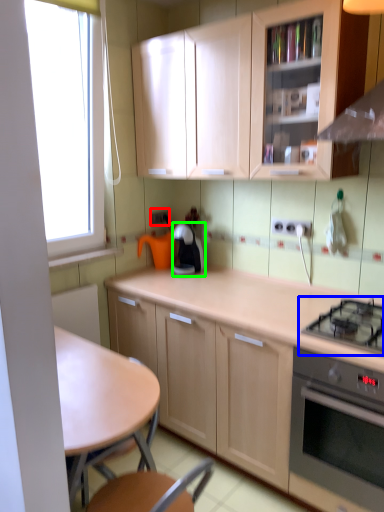
Question: Which is farther away from electric outlet (highlighted by a red box)? gas stove (highlighted by a blue box) or kitchen appliance (highlighted by a green box)?

Choices:
 (A) gas stove
 (B) kitchen appliance

Answer: (A)